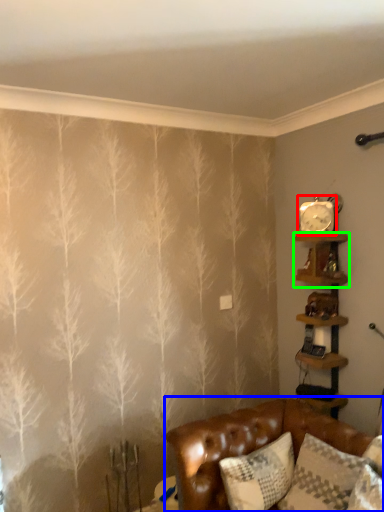
Question: Which object is positioned farthest from clock (highlighted by a red box)? Select from studio couch (highlighted by a blue box) and shelf (highlighted by a green box).

Choices:
 (A) studio couch
 (B) shelf

Answer: (A)